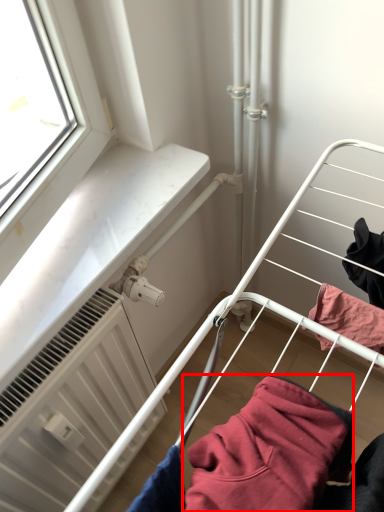
Question: From the image's perspective, considering the relative positions of clothing (annotated by the red box) and radiator in the image provided, where is clothing (annotated by the red box) located with respect to the staircase?

Choices:
 (A) above
 (B) below

Answer: (A)